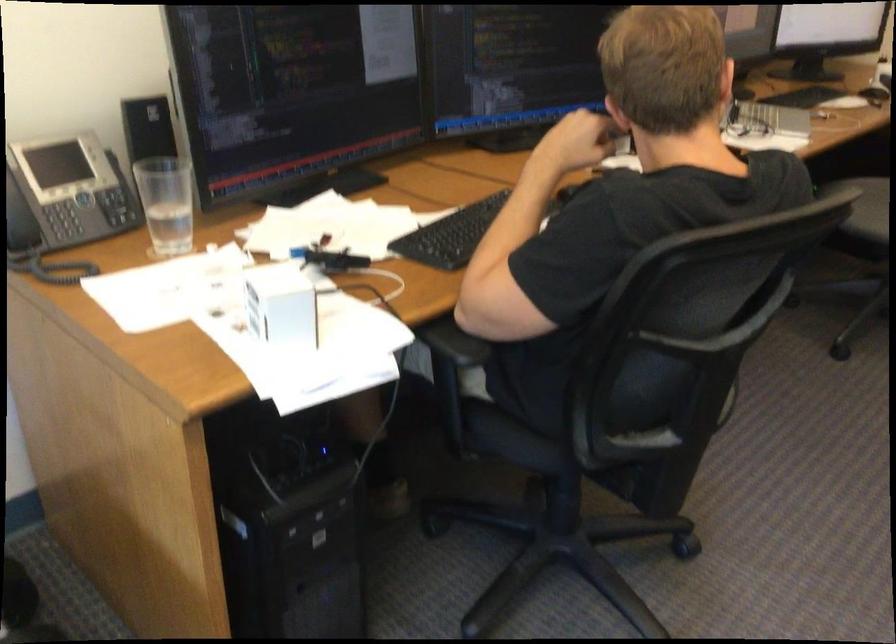
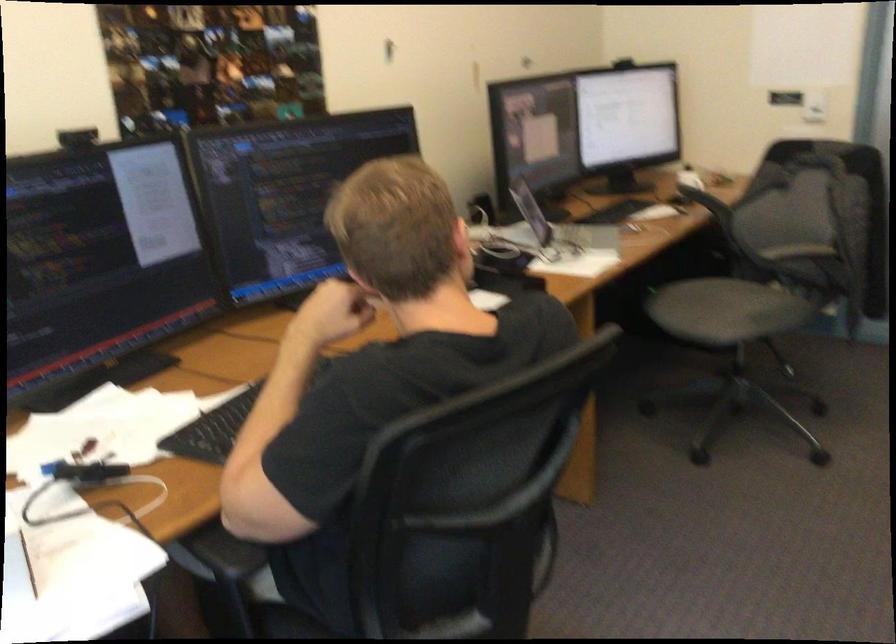
Question: The images are taken continuously from a first-person perspective. In which direction is your viewpoint rotating?

Choices:
 (A) Left
 (B) Right
 (C) Up
 (D) Down

Answer: (C)